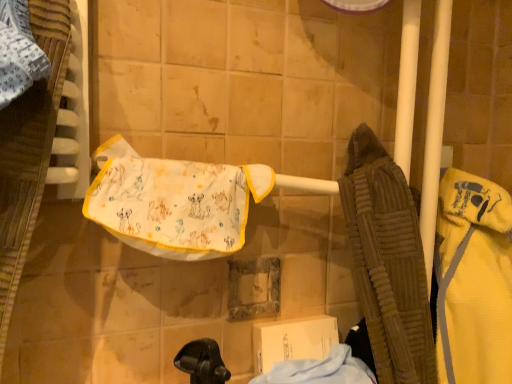
Question: Considering the positions of yellow fleece bathrobe at right and light blue cotton cloth at lower center in the image, is yellow fleece bathrobe at right bigger or smaller than light blue cotton cloth at lower center?

Choices:
 (A) small
 (B) big

Answer: (B)

Question: Considering the positions of yellow fleece bathrobe at right and light blue cotton cloth at lower center in the image, is yellow fleece bathrobe at right taller or shorter than light blue cotton cloth at lower center?

Choices:
 (A) short
 (B) tall

Answer: (B)

Question: Which object is the farthest from the white fabric towel at center?

Choices:
 (A) light blue cotton cloth at lower center
 (B) yellow fleece bathrobe at right

Answer: (B)

Question: Which is farther from the light blue cotton cloth at lower center?

Choices:
 (A) white fabric towel at center
 (B) yellow fleece bathrobe at right

Answer: (A)